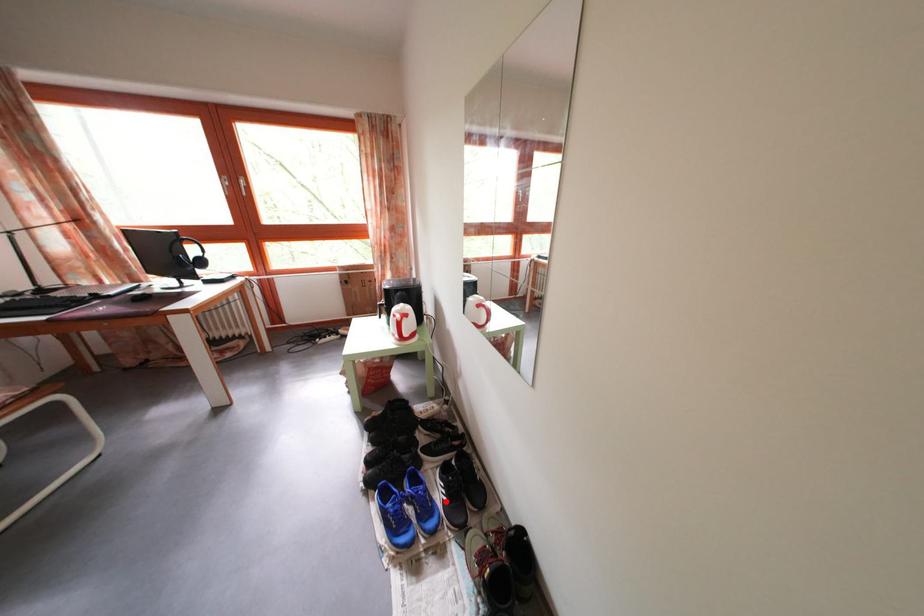
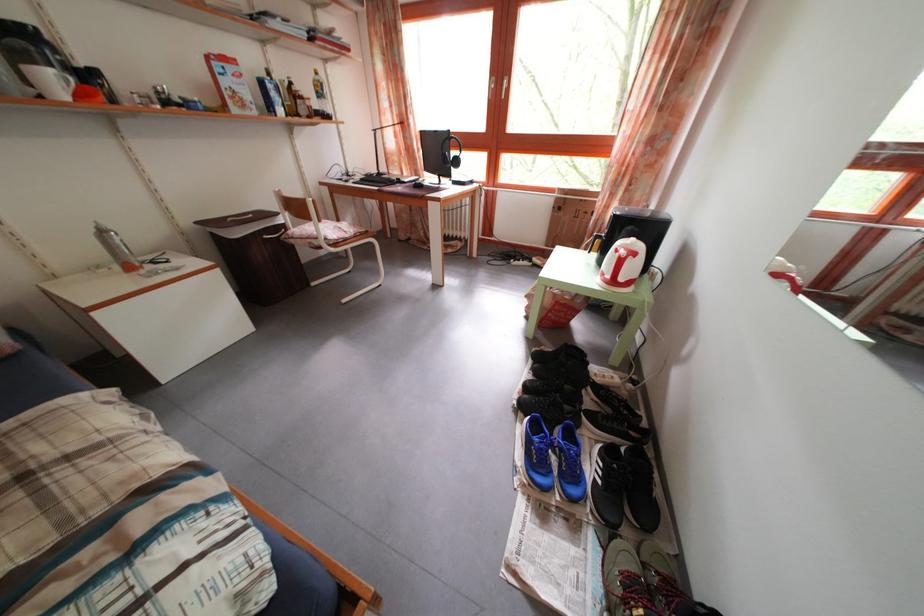
Find the pixel in the second image that matches the highlighted location in the first image.

(599, 477)